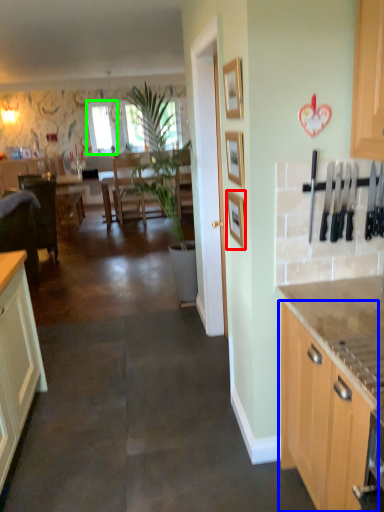
Question: Which is nearer to the picture frame (highlighted by a red box)? cabinetry (highlighted by a blue box) or window screen (highlighted by a green box).

Choices:
 (A) cabinetry
 (B) window screen

Answer: (A)